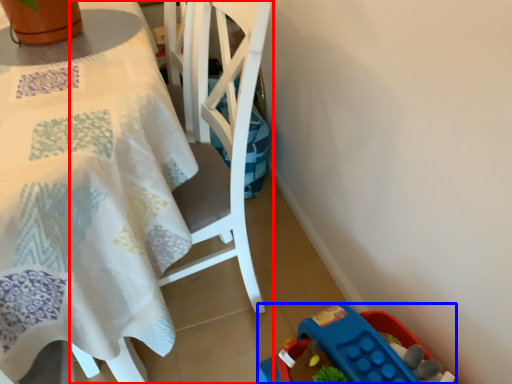
Question: Which object is further to the camera taking this photo, chair (highlighted by a red box) or toy (highlighted by a blue box)?

Choices:
 (A) chair
 (B) toy

Answer: (B)